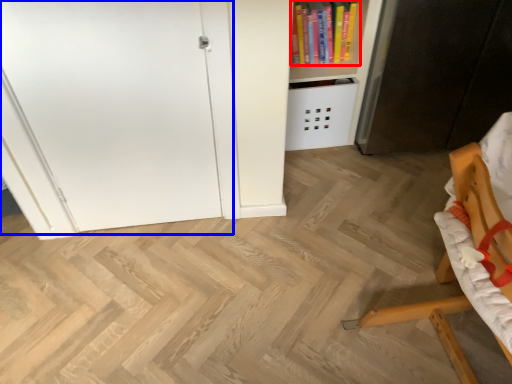
Question: Among these objects, which one is nearest to the camera, book (highlighted by a red box) or door (highlighted by a blue box)?

Choices:
 (A) book
 (B) door

Answer: (B)